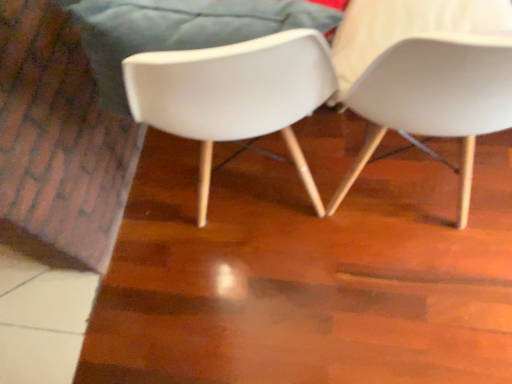
Question: From a real-world perspective, is white matte chair at center, the 1th chair from the left, above or below white plastic chair at right, arranged as the first chair when viewed from the right?

Choices:
 (A) above
 (B) below

Answer: (B)

Question: Does point pos(308,29) appear closer or farther from the camera than point pos(408,52)?

Choices:
 (A) closer
 (B) farther

Answer: (B)

Question: In terms of size, does white matte chair at center, the 1th chair from the left, appear bigger or smaller than white plastic chair at right, arranged as the first chair when viewed from the right?

Choices:
 (A) big
 (B) small

Answer: (B)

Question: From their relative heights in the image, would you say white plastic chair at right, which appears as the 2th chair when viewed from the left, is taller or shorter than white matte chair at center, the second chair in the right-to-left sequence?

Choices:
 (A) tall
 (B) short

Answer: (B)

Question: From the image's perspective, is white plastic chair at right, arranged as the first chair when viewed from the right, above or below white matte chair at center, the second chair in the right-to-left sequence?

Choices:
 (A) below
 (B) above

Answer: (A)

Question: Is point (367, 112) positioned closer to the camera than point (283, 49)?

Choices:
 (A) closer
 (B) farther

Answer: (B)

Question: Is white plastic chair at right, arranged as the first chair when viewed from the right, inside or outside of white matte chair at center, the 1th chair from the left?

Choices:
 (A) outside
 (B) inside

Answer: (A)